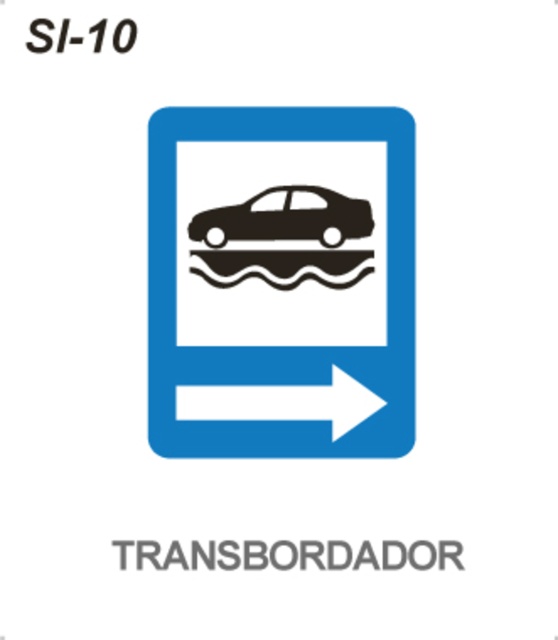
Question: Is black glossy car at center bigger than black matte car at center?

Choices:
 (A) no
 (B) yes

Answer: (B)

Question: Based on their relative distances, which object is farther from the black glossy car at center?

Choices:
 (A) black matte car at center
 (B) white glossy arrow at center-right

Answer: (B)

Question: Which of the following is the farthest from the observer?

Choices:
 (A) (352, 387)
 (B) (292, 364)

Answer: (B)

Question: Among these objects, which one is farthest from the camera?

Choices:
 (A) black text at upper left
 (B) black matte car at center
 (C) white glossy arrow at center-right
 (D) black glossy car at center

Answer: (B)

Question: Where is white glossy arrow at center-right located in relation to black text at upper left in the image?

Choices:
 (A) left
 (B) right

Answer: (B)

Question: Does black matte car at center come in front of white glossy arrow at center-right?

Choices:
 (A) no
 (B) yes

Answer: (A)